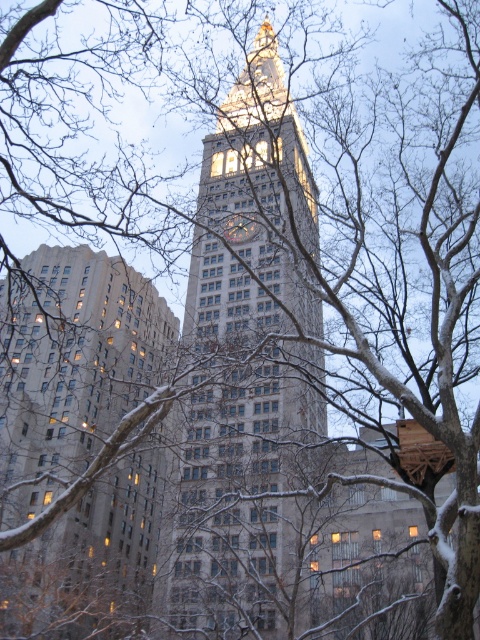
You are a city planner assessing the distance between two landmarks in the image. The stone clock tower at center and the gray stone building at center are both important structures. Based on the scene, can you determine if they are the same building or separate structures?

The stone clock tower at center and the gray stone building at center are separate structures since they are 77.74 feet apart from each other.

You are standing in a snowy park and want to take a photo of the stone clock tower at center. If you are exactly 46.42 meters away from it, will you be able to capture the entire tower in your smartphone camera without moving closer or farther?

The stone clock tower at center is 46.42 meters away from the camera. Since you are exactly at that distance, your smartphone camera should be able to capture the entire tower without needing to move closer or farther, provided the camera has a wide enough angle.

You are standing in a winter landscape with snow on the trees. You see the stone clock tower at center. If you want to take a photo of the tower with the snow covered branches in the foreground, where should you position yourself relative to the tower?

You should position yourself in front of the stone clock tower at center, where the leafless tree branches with snow are located in the foreground to frame the tower in your photo.